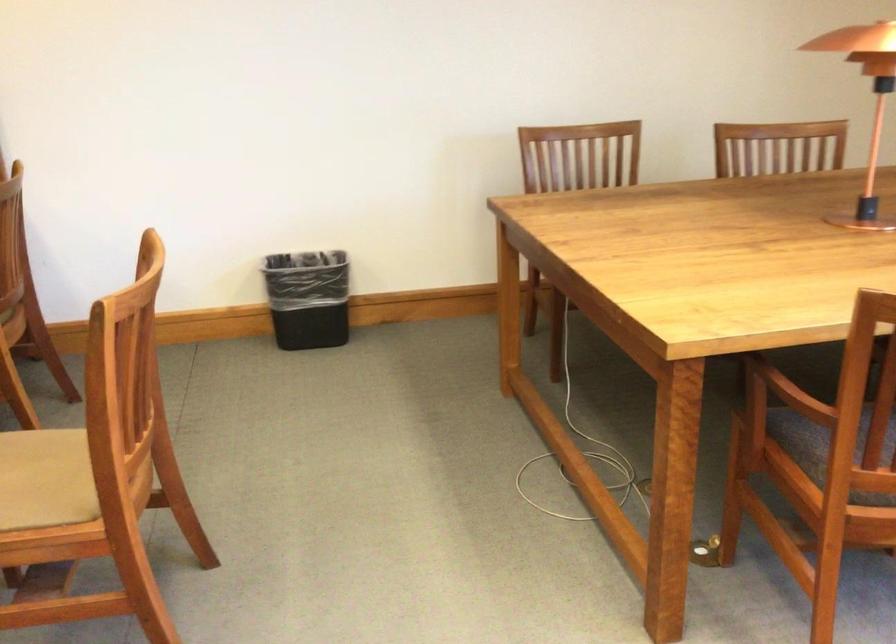
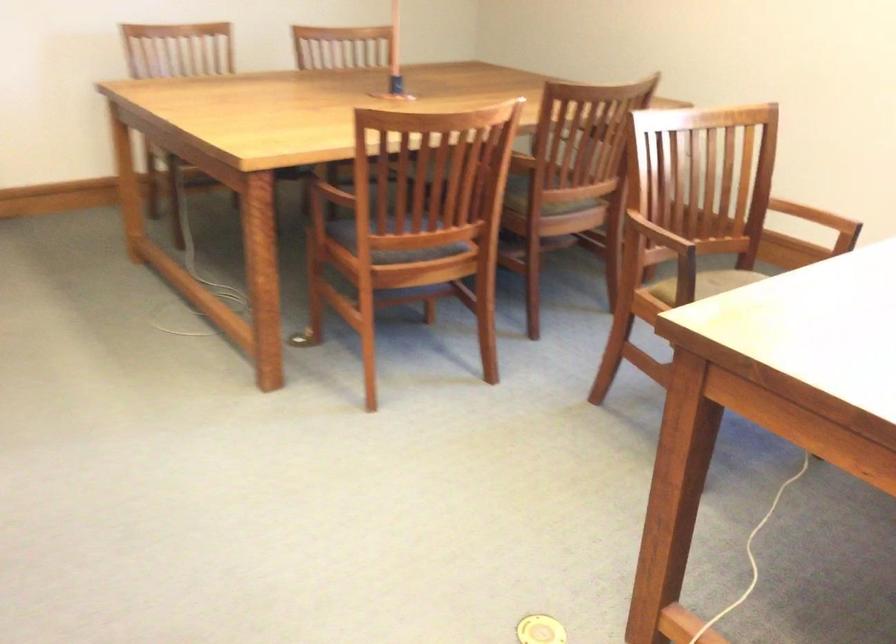
Question: Which direction would the cameraman need to move to produce the second image? Reply with the corresponding letter.

Choices:
 (A) Left
 (B) Right
 (C) Forward
 (D) Backward

Answer: (D)